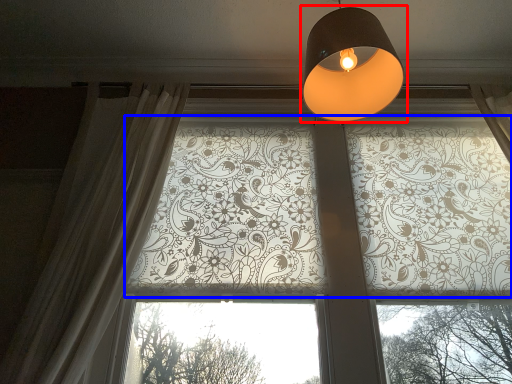
Question: Which point is closer to the camera, lamp (highlighted by a red box) or bay window (highlighted by a blue box)?

Choices:
 (A) lamp
 (B) bay window

Answer: (A)